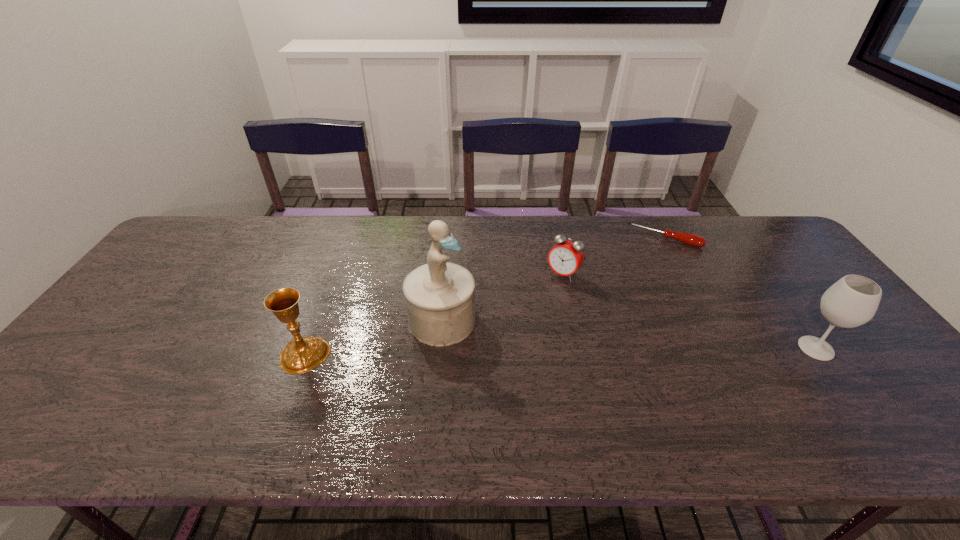
Locate an element on the screen. The image size is (960, 540). free space between the wineglass and the tallest object is located at coordinates (629, 334).

Identify the location of vacant area that lies between the tallest object and the rightmost object. (629, 334).

I want to click on vacant area that lies between the fourth object from left to right and the alarm clock, so click(613, 256).

Image resolution: width=960 pixels, height=540 pixels. What are the coordinates of `free spot between the wineglass and the screwdriver` in the screenshot? It's located at (740, 293).

The image size is (960, 540). I want to click on free spot between the farthest object and the chalice, so click(485, 296).

Identify which object is the fourth closest to the fourth object from left to right. Please provide its 2D coordinates. Your answer should be formatted as a tuple, i.e. [(x, y)], where the tuple contains the x and y coordinates of a point satisfying the conditions above.

[(302, 354)]

What are the coordinates of `object that is the third closest to the tallest object` in the screenshot? It's located at (693, 240).

Identify the location of vacant region that satisfies the following two spatial constraints: 1. on the back side of the fourth object from right to left; 2. on the left side of the chalice. (318, 320).

Where is `vacant space that satisfies the following two spatial constraints: 1. on the front side of the second object from left to right; 2. on the left side of the wineglass`? This screenshot has width=960, height=540. vacant space that satisfies the following two spatial constraints: 1. on the front side of the second object from left to right; 2. on the left side of the wineglass is located at coordinates (440, 348).

The width and height of the screenshot is (960, 540). Identify the location of free spot that satisfies the following two spatial constraints: 1. on the back side of the tallest object; 2. on the right side of the fourth tallest object. (446, 274).